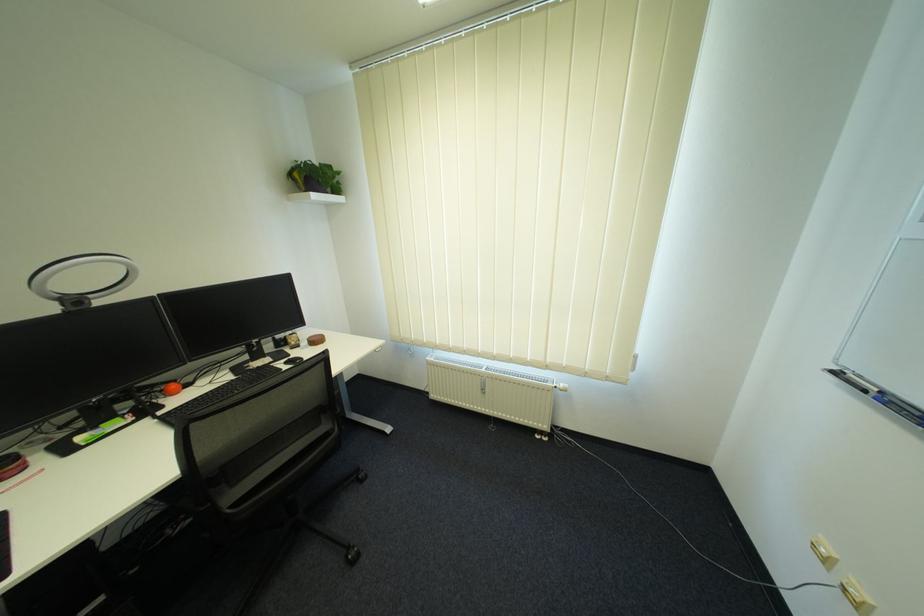
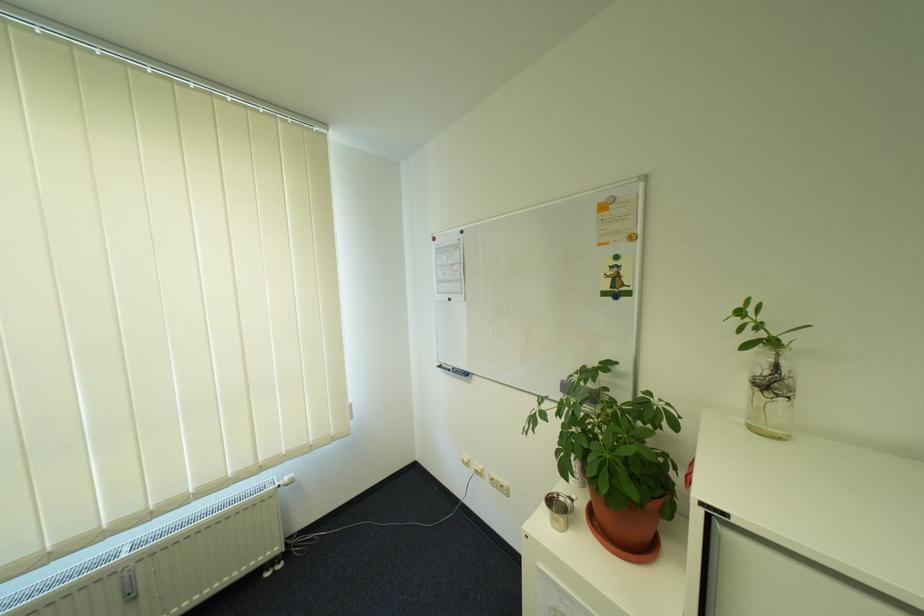
Where in the second image is the point corresponding to point 874,392 from the first image?

(458, 371)